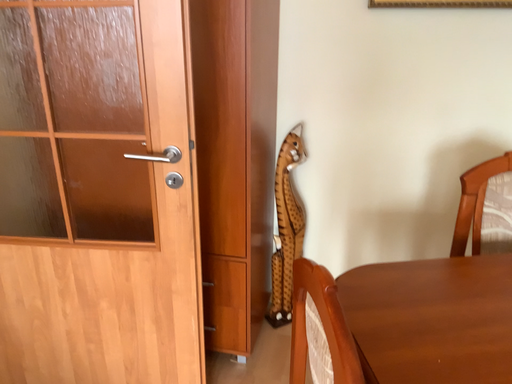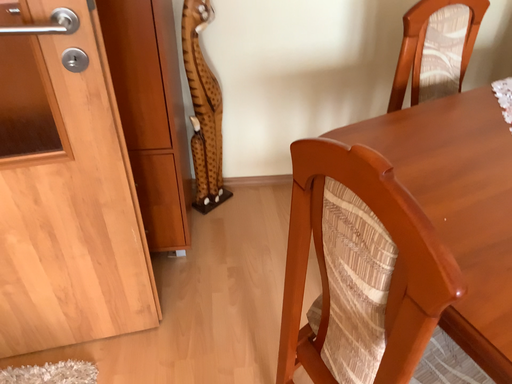
Question: How did the camera likely rotate when shooting the video?

Choices:
 (A) rotated left
 (B) rotated right

Answer: (B)